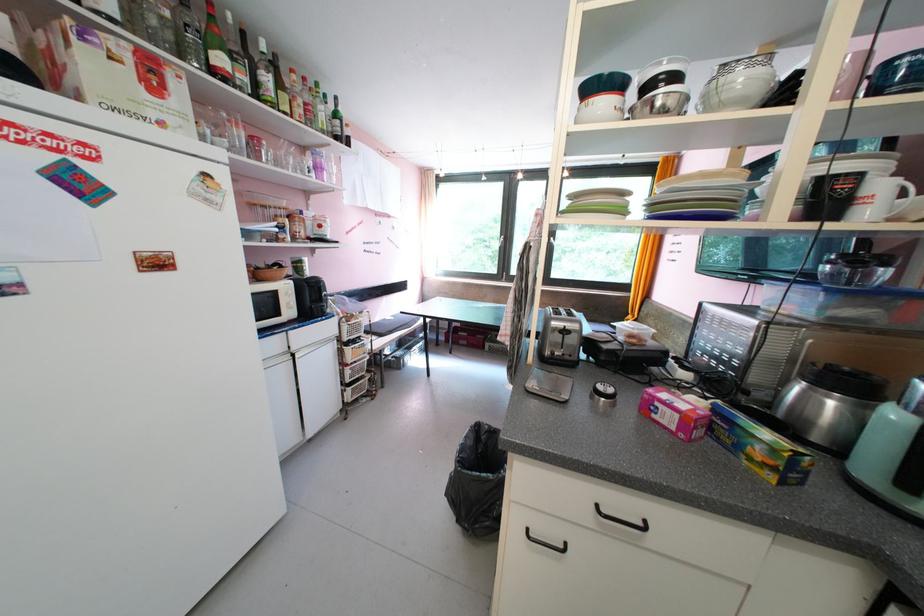
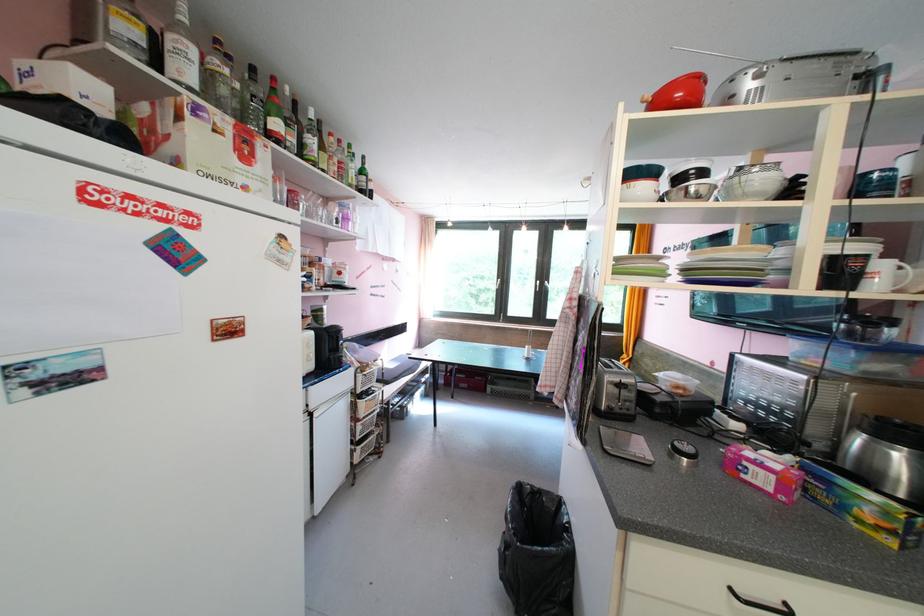
Question: The images are taken continuously from a first-person perspective. In which direction are you moving?

Choices:
 (A) Left
 (B) Right
 (C) Forward
 (D) Backward

Answer: (A)